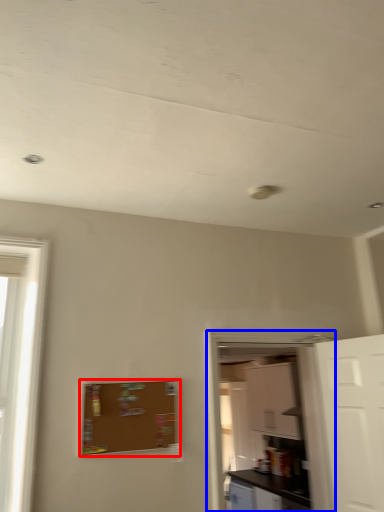
Question: Which object is closer to the camera taking this photo, bulletin board (highlighted by a red box) or screen door (highlighted by a blue box)?

Choices:
 (A) bulletin board
 (B) screen door

Answer: (A)